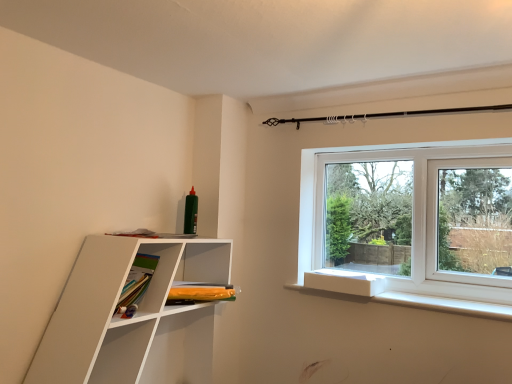
Question: Is point (142, 365) positioned closer to the camera than point (173, 301)?

Choices:
 (A) farther
 (B) closer

Answer: (B)

Question: Is white matte shelf at left bigger or smaller than orange matte bookshelf at lower left?

Choices:
 (A) big
 (B) small

Answer: (A)

Question: Based on their positions, is white matte shelf at left located to the left or right of orange matte bookshelf at lower left?

Choices:
 (A) right
 (B) left

Answer: (B)

Question: Does point (196, 283) appear closer or farther from the camera than point (224, 269)?

Choices:
 (A) farther
 (B) closer

Answer: (A)

Question: Is orange matte bookshelf at lower left to the left or to the right of white matte shelf at left in the image?

Choices:
 (A) left
 (B) right

Answer: (B)

Question: From the image's perspective, relative to white matte shelf at left, is orange matte bookshelf at lower left above or below?

Choices:
 (A) above
 (B) below

Answer: (A)

Question: Relative to white matte shelf at left, is orange matte bookshelf at lower left in front or behind?

Choices:
 (A) front
 (B) behind

Answer: (B)